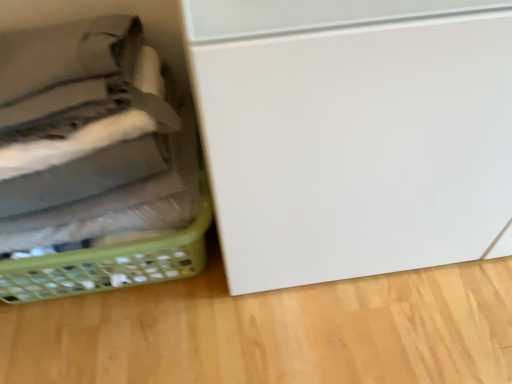
Question: Is green plastic basket at left, acting as the 1th basket starting from the front, shorter than green plastic basket at lower left, the 1th basket from the back?

Choices:
 (A) no
 (B) yes

Answer: (A)

Question: From the image's perspective, is green plastic basket at left, acting as the 1th basket starting from the front, on top of green plastic basket at lower left, the 1th basket from the back?

Choices:
 (A) yes
 (B) no

Answer: (A)

Question: From a real-world perspective, is green plastic basket at left, the second basket positioned from the back, physically above green plastic basket at lower left, which ranks as the second basket in front-to-back order?

Choices:
 (A) no
 (B) yes

Answer: (B)

Question: From the image's perspective, is green plastic basket at left, the second basket positioned from the back, below green plastic basket at lower left, the 1th basket from the back?

Choices:
 (A) yes
 (B) no

Answer: (B)

Question: Is green plastic basket at left, the second basket positioned from the back, surrounding green plastic basket at lower left, the 1th basket from the back?

Choices:
 (A) yes
 (B) no

Answer: (B)

Question: Does green plastic basket at left, the second basket positioned from the back, come in front of green plastic basket at lower left, which ranks as the second basket in front-to-back order?

Choices:
 (A) yes
 (B) no

Answer: (A)

Question: Would you say green plastic basket at lower left, which ranks as the second basket in front-to-back order, is outside green plastic basket at left, the second basket positioned from the back?

Choices:
 (A) yes
 (B) no

Answer: (A)

Question: Does green plastic basket at lower left, which ranks as the second basket in front-to-back order, have a greater width compared to green plastic basket at left, the second basket positioned from the back?

Choices:
 (A) no
 (B) yes

Answer: (B)

Question: Is green plastic basket at left, the second basket positioned from the back, located within green plastic basket at lower left, which ranks as the second basket in front-to-back order?

Choices:
 (A) no
 (B) yes

Answer: (A)

Question: Is green plastic basket at lower left, which ranks as the second basket in front-to-back order, turned away from green plastic basket at left, acting as the 1th basket starting from the front?

Choices:
 (A) yes
 (B) no

Answer: (B)

Question: Does green plastic basket at lower left, the 1th basket from the back, come behind green plastic basket at left, acting as the 1th basket starting from the front?

Choices:
 (A) no
 (B) yes

Answer: (B)

Question: From a real-world perspective, does green plastic basket at lower left, which ranks as the second basket in front-to-back order, sit lower than green plastic basket at left, the second basket positioned from the back?

Choices:
 (A) no
 (B) yes

Answer: (B)

Question: Is green plastic basket at lower left, the 1th basket from the back, situated inside green plastic basket at left, the second basket positioned from the back, or outside?

Choices:
 (A) outside
 (B) inside

Answer: (A)